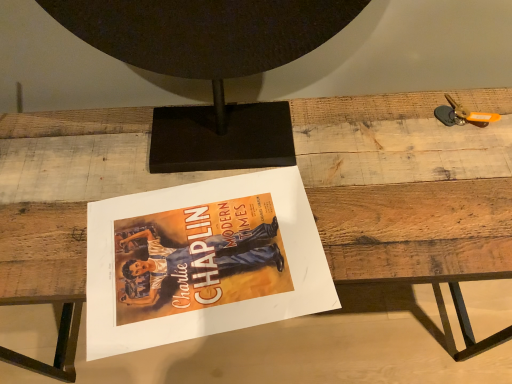
Locate an element on the screen. The width and height of the screenshot is (512, 384). spots to the right of matte black round table at center is located at coordinates (403, 170).